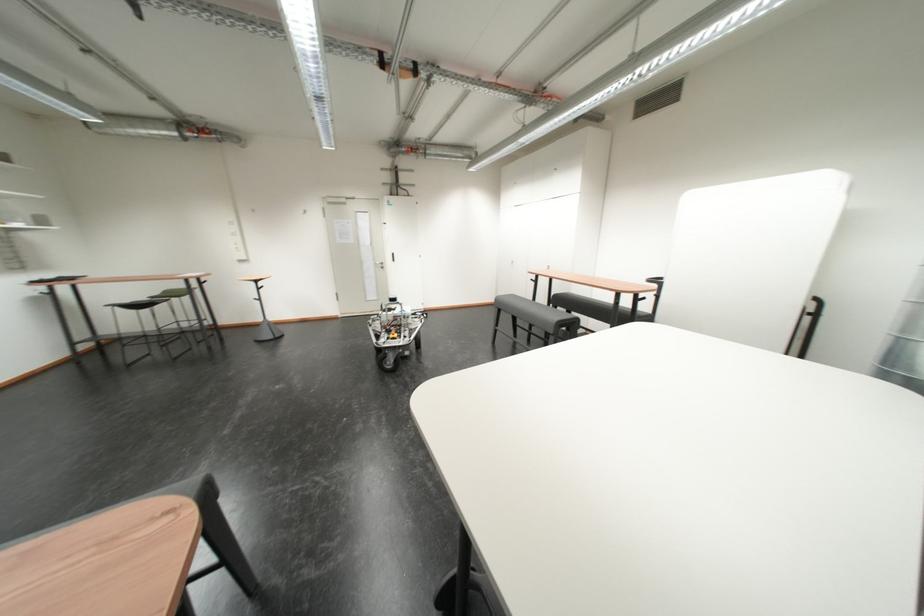
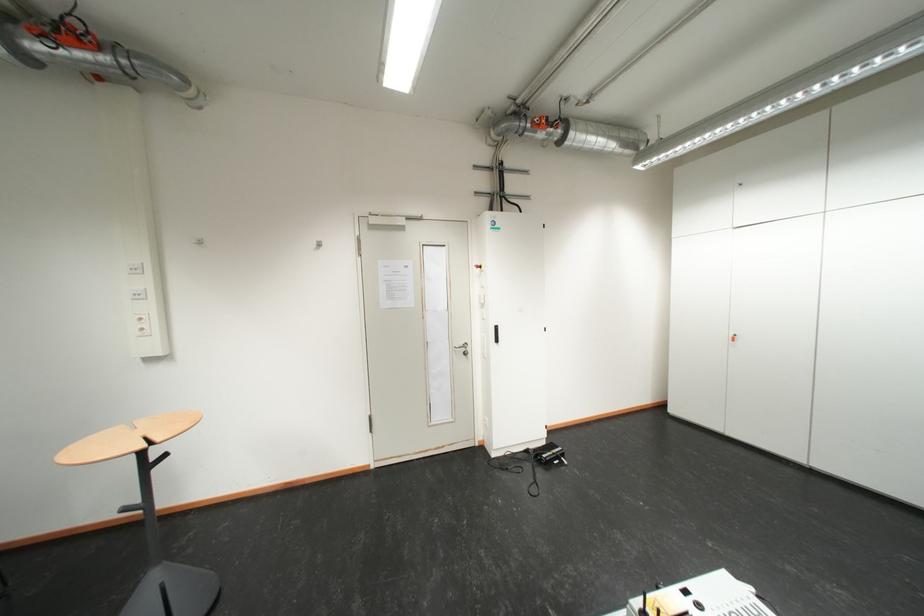
In the second image, find the point that corresponds to pixel 197 140 in the first image.

(35, 60)